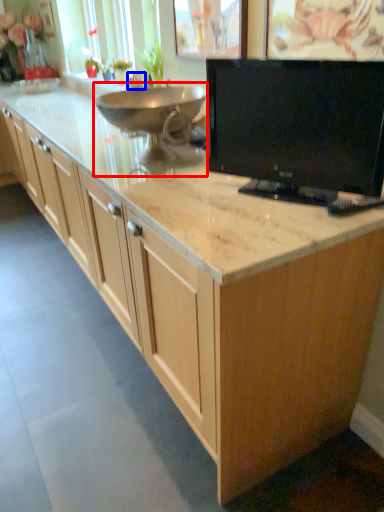
Question: Which object is closer to the camera taking this photo, appliance (highlighted by a red box) or faucet (highlighted by a blue box)?

Choices:
 (A) appliance
 (B) faucet

Answer: (A)